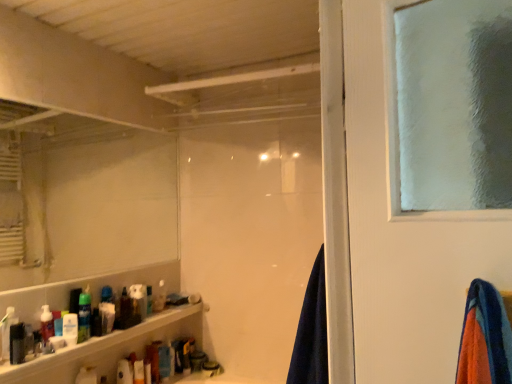
Describe the element at coordinates (106, 310) in the screenshot. The width and height of the screenshot is (512, 384). I see `white matte toothpaste tube at lower left, placed as the sixth toiletry when sorted from front to back` at that location.

How much space does white matte toothpaste tube at lower left, placed as the sixth toiletry when sorted from front to back, occupy horizontally?

white matte toothpaste tube at lower left, placed as the sixth toiletry when sorted from front to back, is 4.35 inches wide.

Identify the location of navy blue fabric at center. The height and width of the screenshot is (384, 512). (311, 331).

Describe the element at coordinates (311, 331) in the screenshot. Image resolution: width=512 pixels, height=384 pixels. I see `navy blue fabric at center` at that location.

Identify the location of white glossy bottle at lower left, placed as the seventh toiletry when sorted from back to front. (7, 332).

Describe the element at coordinates (7, 332) in the screenshot. I see `white glossy bottle at lower left, which ranks as the 2th toiletry in front-to-back order` at that location.

At what (x,y) coordinates should I click in order to perform the action: click on translucent plastic soap dispenser at lower left, which ranks as the sixth toiletry in back-to-front order. Please return your answer as a coordinate pair (x, y). Looking at the image, I should click on (46, 323).

The width and height of the screenshot is (512, 384). Find the location of `white matte toothpaste tube at lower left, the third toiletry in the back-to-front sequence`. white matte toothpaste tube at lower left, the third toiletry in the back-to-front sequence is located at coordinates (106, 310).

Between translucent plastic bottle at lower left, the 1th toiletry positioned from the back, and matte black bottle at lower left, marked as the eighth toiletry in a back-to-front arrangement, which one has more height?

matte black bottle at lower left, marked as the eighth toiletry in a back-to-front arrangement, is taller.

From the picture: Is translucent plastic bottle at lower left, the 1th toiletry positioned from the back, located outside matte black bottle at lower left, marked as the eighth toiletry in a back-to-front arrangement?

Yes.

Is translucent plastic bottle at lower left, the 1th toiletry positioned from the back, positioned before matte black bottle at lower left, the first toiletry in the front-to-back sequence?

No, translucent plastic bottle at lower left, the 1th toiletry positioned from the back, is further to the viewer.

Is translucent plastic bottles at lower left beside matte black bottle at lower left, the first toiletry in the front-to-back sequence?

translucent plastic bottles at lower left and matte black bottle at lower left, the first toiletry in the front-to-back sequence, are clearly separated.

In the scene shown: Is translucent plastic bottles at lower left located outside matte black bottle at lower left, marked as the eighth toiletry in a back-to-front arrangement?

That's correct, translucent plastic bottles at lower left is outside of matte black bottle at lower left, marked as the eighth toiletry in a back-to-front arrangement.

Where is `shelf below the matte black bottle at lower left, the first toiletry in the front-to-back sequence (from the image's perspective)`? This screenshot has width=512, height=384. shelf below the matte black bottle at lower left, the first toiletry in the front-to-back sequence (from the image's perspective) is located at coordinates pyautogui.click(x=105, y=348).

Which is closer to the camera, (44, 293) or (14, 336)?

Point (44, 293) is farther from the camera than point (14, 336).

Considering the relative positions of white matte toothpaste tube at lower left, the third toiletry in the back-to-front sequence, and translucent plastic spray can at lower left, which is counted as the 4th toiletry, starting from the back, in the image provided, is white matte toothpaste tube at lower left, the third toiletry in the back-to-front sequence, to the right of translucent plastic spray can at lower left, which is counted as the 4th toiletry, starting from the back, from the viewer's perspective?

Indeed, white matte toothpaste tube at lower left, the third toiletry in the back-to-front sequence, is positioned on the right side of translucent plastic spray can at lower left, which is counted as the 4th toiletry, starting from the back.

Is white matte toothpaste tube at lower left, placed as the sixth toiletry when sorted from front to back, placed right next to translucent plastic spray can at lower left, placed as the fifth toiletry when sorted from front to back?

Yes, white matte toothpaste tube at lower left, placed as the sixth toiletry when sorted from front to back, is in contact with translucent plastic spray can at lower left, placed as the fifth toiletry when sorted from front to back.

Is point (101, 332) closer to viewer compared to point (86, 335)?

No.

What's the angular difference between matte black bottle at lower left, marked as the eighth toiletry in a back-to-front arrangement, and white matte toothpaste tube at lower left, the third toiletry in the back-to-front sequence,'s facing directions?

0.000556 degrees separate the facing orientations of matte black bottle at lower left, marked as the eighth toiletry in a back-to-front arrangement, and white matte toothpaste tube at lower left, the third toiletry in the back-to-front sequence.

From the image's perspective, is matte black bottle at lower left, the first toiletry in the front-to-back sequence, above or below white matte toothpaste tube at lower left, the third toiletry in the back-to-front sequence?

matte black bottle at lower left, the first toiletry in the front-to-back sequence, is above white matte toothpaste tube at lower left, the third toiletry in the back-to-front sequence.

Is matte black bottle at lower left, the first toiletry in the front-to-back sequence, further to camera compared to white matte toothpaste tube at lower left, the third toiletry in the back-to-front sequence?

No, it is in front of white matte toothpaste tube at lower left, the third toiletry in the back-to-front sequence.

Is white matte toothpaste tube at lower left, placed as the sixth toiletry when sorted from front to back, looking in the opposite direction of translucent plastic bottles at lower left?

No, translucent plastic bottles at lower left is not at the back of white matte toothpaste tube at lower left, placed as the sixth toiletry when sorted from front to back.

Does white matte toothpaste tube at lower left, the third toiletry in the back-to-front sequence, have a larger size compared to translucent plastic bottles at lower left?

No.

Considering the sizes of objects white matte toothpaste tube at lower left, placed as the sixth toiletry when sorted from front to back, and translucent plastic bottles at lower left in the image provided, who is taller, white matte toothpaste tube at lower left, placed as the sixth toiletry when sorted from front to back, or translucent plastic bottles at lower left?

white matte toothpaste tube at lower left, placed as the sixth toiletry when sorted from front to back, is taller.

Does white matte toothpaste tube at lower left, the third toiletry in the back-to-front sequence, have a lesser width compared to translucent plastic bottles at lower left?

Indeed, white matte toothpaste tube at lower left, the third toiletry in the back-to-front sequence, has a lesser width compared to translucent plastic bottles at lower left.

Which of these two, matte black bottle at lower left, marked as the eighth toiletry in a back-to-front arrangement, or translucent plastic spray can at lower left, which is counted as the 4th toiletry, starting from the back, stands shorter?

matte black bottle at lower left, marked as the eighth toiletry in a back-to-front arrangement, is shorter.

From the image's perspective, is matte black bottle at lower left, the first toiletry in the front-to-back sequence, located beneath translucent plastic spray can at lower left, placed as the fifth toiletry when sorted from front to back?

Correct, matte black bottle at lower left, the first toiletry in the front-to-back sequence, appears lower than translucent plastic spray can at lower left, placed as the fifth toiletry when sorted from front to back, in the image.

Considering the positions of objects matte black bottle at lower left, the first toiletry in the front-to-back sequence, and translucent plastic spray can at lower left, placed as the fifth toiletry when sorted from front to back, in the image provided, who is in front, matte black bottle at lower left, the first toiletry in the front-to-back sequence, or translucent plastic spray can at lower left, placed as the fifth toiletry when sorted from front to back,?

matte black bottle at lower left, the first toiletry in the front-to-back sequence, is in front.

How many degrees apart are the facing directions of white glossy bottle at lower left, placed as the seventh toiletry when sorted from back to front, and translucent plastic soap dispenser at lower left, marked as the 3th toiletry in a front-to-back arrangement?

0.000612 degrees separate the facing orientations of white glossy bottle at lower left, placed as the seventh toiletry when sorted from back to front, and translucent plastic soap dispenser at lower left, marked as the 3th toiletry in a front-to-back arrangement.

Is translucent plastic soap dispenser at lower left, which ranks as the sixth toiletry in back-to-front order, inside white glossy bottle at lower left, which ranks as the 2th toiletry in front-to-back order?

No, translucent plastic soap dispenser at lower left, which ranks as the sixth toiletry in back-to-front order, is located outside of white glossy bottle at lower left, which ranks as the 2th toiletry in front-to-back order.

You are a GUI agent. You are given a task and a screenshot of the screen. Output one action in this format:
    pyautogui.click(x=<x>, y=<y>)
    Task: Click on the 2nd toiletry directly beneath the white glossy bottle at lower left, which ranks as the 2th toiletry in front-to-back order (from a real-world perspective)
    The width and height of the screenshot is (512, 384).
    Given the screenshot: What is the action you would take?
    point(46,323)

Measure the distance between white glossy bottle at lower left, which ranks as the 2th toiletry in front-to-back order, and translucent plastic soap dispenser at lower left, which ranks as the sixth toiletry in back-to-front order.

They are 7.24 inches apart.

This screenshot has width=512, height=384. Identify the location of toiletry that is the 7th one when counting backward from the matte black bottle at lower left, the first toiletry in the front-to-back sequence. (160, 297).

At what (x,y) coordinates should I click in order to perform the action: click on the 3rd toiletry above the translucent plastic bottles at lower left (from a real-world perspective). Please return your answer as a coordinate pair (x, y). Looking at the image, I should click on (17, 343).

Looking at the image, which one is located further to translucent plastic soap dispenser at lower left, marked as the 3th toiletry in a front-to-back arrangement, matte black bottle at lower left, the first toiletry in the front-to-back sequence, or white matte lotion at lower left, which is the fifth toiletry from back to front?

The object further to translucent plastic soap dispenser at lower left, marked as the 3th toiletry in a front-to-back arrangement, is matte black bottle at lower left, the first toiletry in the front-to-back sequence.

Considering their positions, is white matte toothpaste tube at lower left, placed as the sixth toiletry when sorted from front to back, positioned closer to white matte lotion at lower left, acting as the 4th toiletry starting from the front, than translucent plastic spray can at lower left, placed as the fifth toiletry when sorted from front to back?

translucent plastic spray can at lower left, placed as the fifth toiletry when sorted from front to back, lies closer to white matte lotion at lower left, acting as the 4th toiletry starting from the front, than the other object.

In the scene shown: Which object lies nearer to the anchor point translucent plastic spray can at lower left, placed as the fifth toiletry when sorted from front to back, white matte lotion at lower left, acting as the 4th toiletry starting from the front, or navy blue fabric at center?

white matte lotion at lower left, acting as the 4th toiletry starting from the front, is closer to translucent plastic spray can at lower left, placed as the fifth toiletry when sorted from front to back.

Considering their positions, is matte black bottle at lower left, marked as the eighth toiletry in a back-to-front arrangement, positioned closer to white matte soap dispenser at center, marked as the 7th toiletry in a front-to-back arrangement, than white matte mirror at upper left?

matte black bottle at lower left, marked as the eighth toiletry in a back-to-front arrangement, lies closer to white matte soap dispenser at center, marked as the 7th toiletry in a front-to-back arrangement, than the other object.

When comparing their distances from white matte lotion at lower left, which is the fifth toiletry from back to front, does navy blue fabric at center or matte black bottle at lower left, marked as the eighth toiletry in a back-to-front arrangement, seem closer?

Based on the image, matte black bottle at lower left, marked as the eighth toiletry in a back-to-front arrangement, appears to be nearer to white matte lotion at lower left, which is the fifth toiletry from back to front.

Which object lies nearer to the anchor point white matte soap dispenser at center, the second toiletry from the back, translucent plastic bottle at lower left, the 1th toiletry positioned from the back, or translucent plastic bottles at lower left?

translucent plastic bottle at lower left, the 1th toiletry positioned from the back, lies closer to white matte soap dispenser at center, the second toiletry from the back, than the other object.

From the image, which object appears to be farther from white matte soap dispenser at center, marked as the 7th toiletry in a front-to-back arrangement, navy blue fabric at center or translucent plastic soap dispenser at lower left, which ranks as the sixth toiletry in back-to-front order?

Based on the image, navy blue fabric at center appears to be further to white matte soap dispenser at center, marked as the 7th toiletry in a front-to-back arrangement.

From the image, which object appears to be farther from translucent plastic spray can at lower left, placed as the fifth toiletry when sorted from front to back, white glossy bottle at lower left, which ranks as the 2th toiletry in front-to-back order, or translucent plastic bottles at lower left?

The object further to translucent plastic spray can at lower left, placed as the fifth toiletry when sorted from front to back, is white glossy bottle at lower left, which ranks as the 2th toiletry in front-to-back order.

Find the location of a particular element. The height and width of the screenshot is (384, 512). mirror between white glossy bottle at lower left, which ranks as the 2th toiletry in front-to-back order, and translucent plastic bottle at lower left, the 1th toiletry positioned from the back, along the z-axis is located at coordinates (93, 201).

Identify the location of mirror located between translucent plastic soap dispenser at lower left, marked as the 3th toiletry in a front-to-back arrangement, and navy blue fabric at center in the left-right direction. (93, 201).

Find the location of a particular element. This screenshot has height=384, width=512. shelf situated between matte black bottle at lower left, marked as the eighth toiletry in a back-to-front arrangement, and navy blue fabric at center from left to right is located at coordinates (105, 348).

You are a GUI agent. You are given a task and a screenshot of the screen. Output one action in this format:
    pyautogui.click(x=<x>, y=<y>)
    Task: Click on the toiletry between white matte mirror at upper left and white glossy bottle at lower left, placed as the seventh toiletry when sorted from back to front, in the vertical direction
    The width and height of the screenshot is (512, 384).
    Given the screenshot: What is the action you would take?
    pyautogui.click(x=84, y=317)